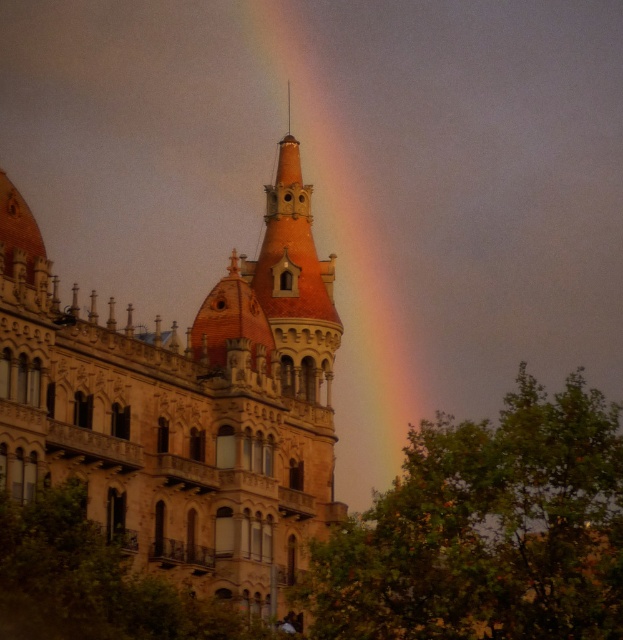
Does brown stone palace at center have a greater width compared to rainbow at upper center?

In fact, brown stone palace at center might be narrower than rainbow at upper center.

Between brown stone palace at center and rainbow at upper center, which one appears on the left side from the viewer's perspective?

Positioned to the left is brown stone palace at center.

Find the location of `brown stone palace at center`. brown stone palace at center is located at coordinates (183, 404).

Is point (523, 592) more distant than point (376, 308)?

No, it is in front of (376, 308).

Is green leafy tree at lower right shorter than rainbow at upper center?

Yes.

The height and width of the screenshot is (640, 623). What do you see at coordinates (487, 529) in the screenshot? I see `green leafy tree at lower right` at bounding box center [487, 529].

Find the location of `green leafy tree at lower right`. green leafy tree at lower right is located at coordinates (487, 529).

Can you confirm if brown stone palace at center is positioned below green leafy tree at lower right?

No, brown stone palace at center is not below green leafy tree at lower right.

Does brown stone palace at center have a lesser width compared to green leafy tree at lower right?

Yes.

Who is more distant from viewer, (257,612) or (392,554)?

Point (257,612)

The image size is (623, 640). I want to click on brown stone palace at center, so click(183, 404).